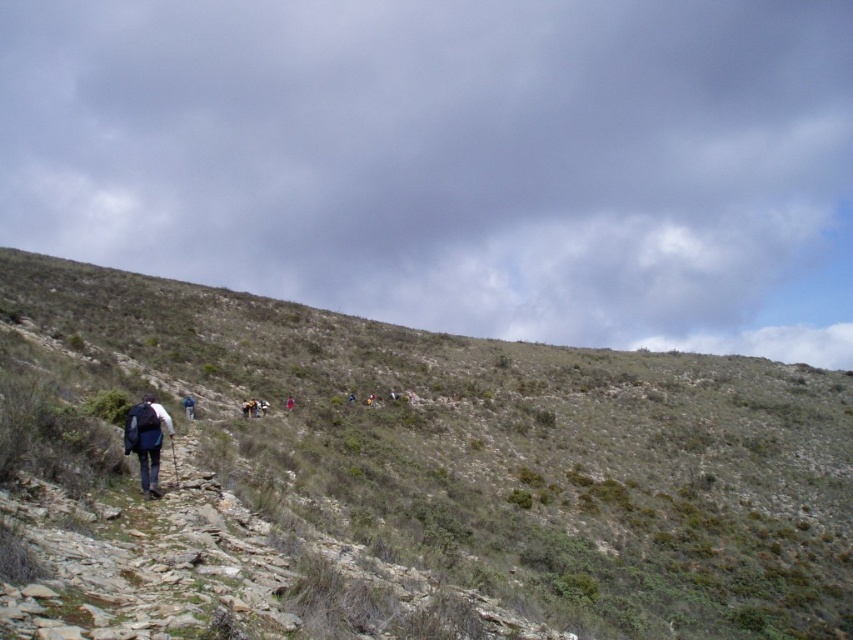
Question: Considering the real-world distances, which object is closest to the blue fabric jacket at lower left?

Choices:
 (A) dark blue backpack at lower left
 (B) red fabric person at center

Answer: (B)

Question: Among these objects, which one is nearest to the camera?

Choices:
 (A) blue fabric jacket at lower left
 (B) dark blue backpack at lower left

Answer: (B)

Question: Is green grassy hillside at center to the right of red fabric person at center from the viewer's perspective?

Choices:
 (A) yes
 (B) no

Answer: (A)

Question: Does dark blue backpack at lower left come behind blue fabric jacket at lower left?

Choices:
 (A) no
 (B) yes

Answer: (A)

Question: Is blue fabric jacket at lower left smaller than red fabric person at center?

Choices:
 (A) yes
 (B) no

Answer: (B)

Question: Which object is farther from the camera taking this photo?

Choices:
 (A) dark blue backpack at lower left
 (B) blue fabric jacket at lower left
 (C) red fabric person at center
 (D) green grassy hillside at center

Answer: (C)